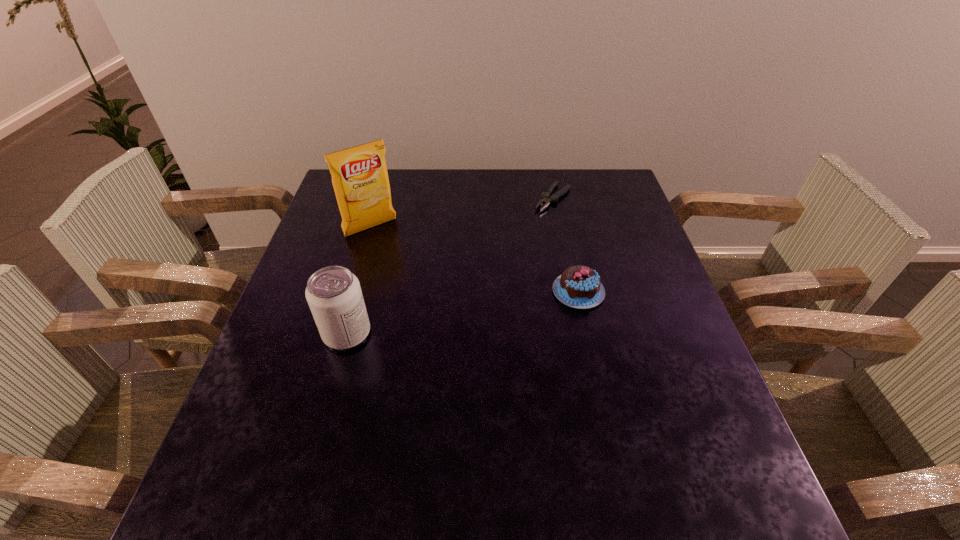
Identify the location of free location located on the front of the second farthest object with the logo. The width and height of the screenshot is (960, 540). (442, 313).

Where is `vacant space located on the front of the second farthest object with the logo`? Image resolution: width=960 pixels, height=540 pixels. vacant space located on the front of the second farthest object with the logo is located at coordinates (450, 323).

Where is `vacant area situated 0.230m on the front of the second farthest object with the logo`? The height and width of the screenshot is (540, 960). vacant area situated 0.230m on the front of the second farthest object with the logo is located at coordinates (421, 287).

Where is `free space located at the gripping part of the pliers`? This screenshot has height=540, width=960. free space located at the gripping part of the pliers is located at coordinates (479, 279).

This screenshot has height=540, width=960. Identify the location of blank space located 0.390m at the gripping part of the pliers. (470, 288).

You are a GUI agent. You are given a task and a screenshot of the screen. Output one action in this format:
    pyautogui.click(x=<x>, y=<y>)
    Task: Click on the vacant space located 0.360m at the gripping part of the pliers
    
    Given the screenshot: What is the action you would take?
    pyautogui.click(x=477, y=281)

Where is `object located in the far edge section of the desktop`? object located in the far edge section of the desktop is located at coordinates (547, 199).

At what (x,y) coordinates should I click in order to perform the action: click on soda can at the left edge. Please return your answer as a coordinate pair (x, y). Looking at the image, I should click on (333, 293).

Where is `crisp (potato chip) positioned at the left edge`? Image resolution: width=960 pixels, height=540 pixels. crisp (potato chip) positioned at the left edge is located at coordinates (360, 179).

Where is `object located at the right edge`? object located at the right edge is located at coordinates (x=579, y=286).